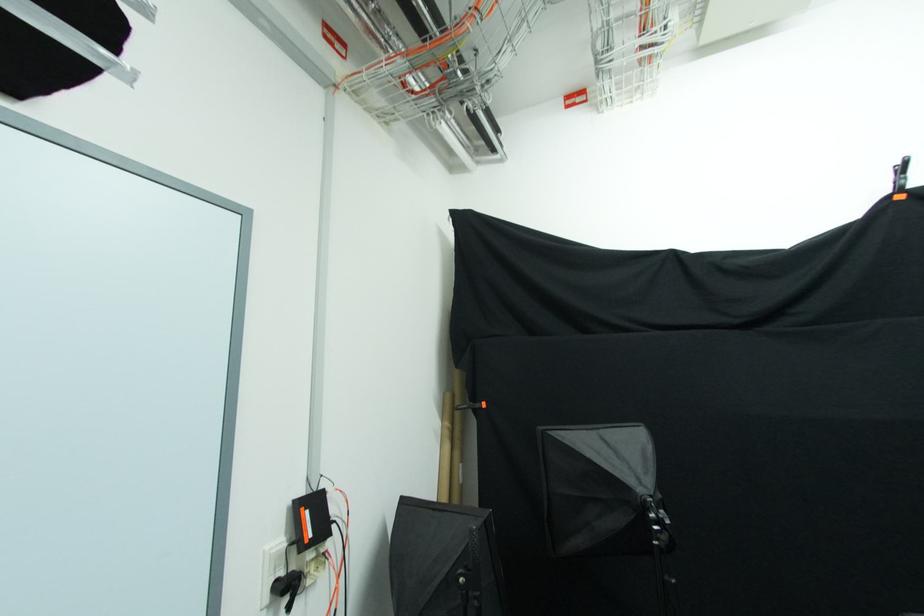
Where is `black power adapter`? The image size is (924, 616). black power adapter is located at coordinates (286, 588).